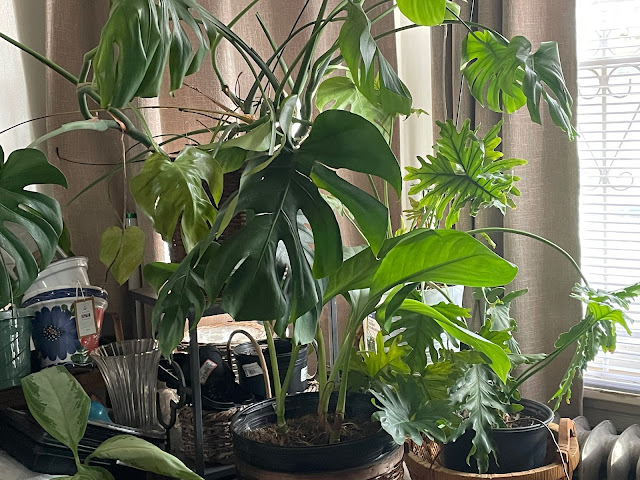
This screenshot has height=480, width=640. Find the location of `curtains`. curtains is located at coordinates (525, 134), (257, 31), (91, 142).